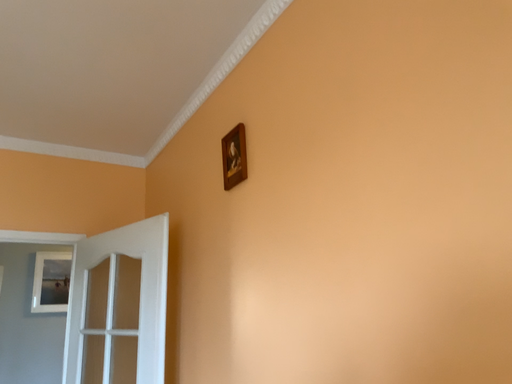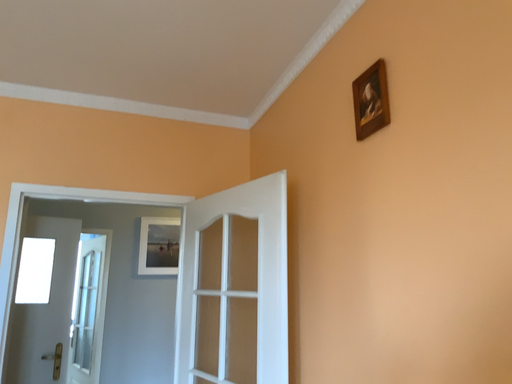
Question: How did the camera likely rotate when shooting the video?

Choices:
 (A) rotated left
 (B) rotated right

Answer: (A)